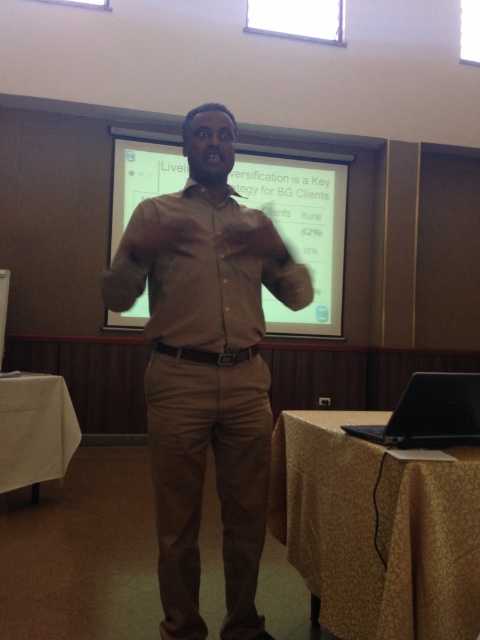
You are organizing a small event and need to place a 18cm tall candle on a surface. You have two options in the scene, the yellow fabric table at lower right and the white cloth at lower left. Which surface can safely hold the candle without it being too tall?

The white cloth at lower left is taller than the yellow fabric table at lower right. Since the candle is 18cm tall, it can be placed on the white cloth at lower left as it provides enough height to safely hold the candle.

You are a photographer standing in the room where the presentation is taking place. You want to take a closeup photo of the yellow fabric table at lower right without moving any furniture. Can you step closer to the table to get a better shot?

The yellow fabric table at lower right is 1.49 meters from viewer, so yes, you can step closer to the yellow fabric table at lower right to get a better shot since it is within a reasonable distance.

Where is the matte khaki shirt at center located in the image?

The matte khaki shirt at center is located at point 0.577 on the x axis and 0.431 on the y axis.